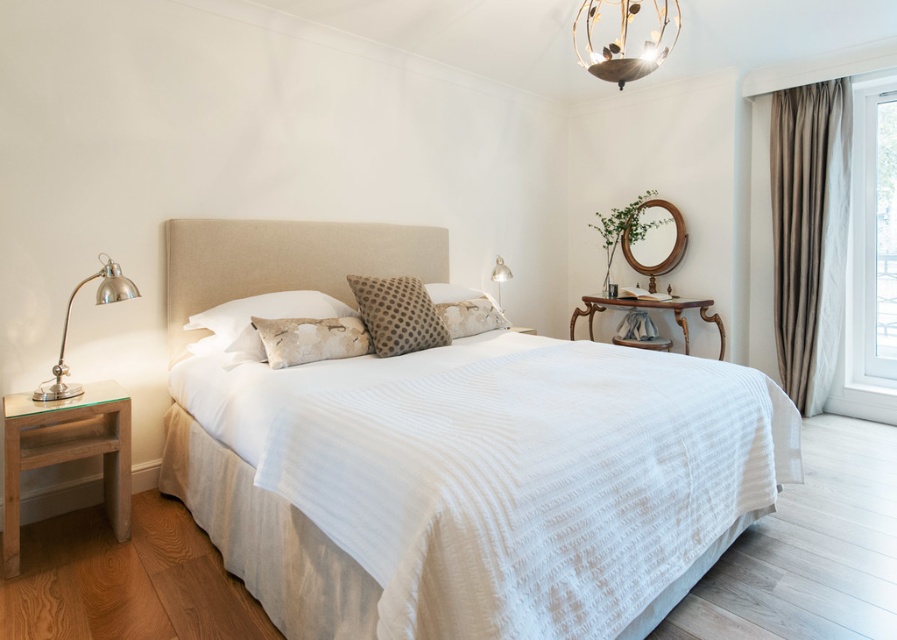
Can you confirm if brown velvet curtain at right is bigger than brown dotted pillow at center?

Correct, brown velvet curtain at right is larger in size than brown dotted pillow at center.

Who is lower down, brown velvet curtain at right or brown dotted pillow at center?

brown dotted pillow at center

Is point (811, 388) more distant than point (373, 320)?

Yes, it is.

Image resolution: width=897 pixels, height=640 pixels. Identify the location of brown velvet curtain at right. (808, 232).

Looking at this image, can you confirm if white textured pillow at center is thinner than fluffy beige pillow at center?

Incorrect, white textured pillow at center's width is not less than fluffy beige pillow at center's.

This screenshot has height=640, width=897. Describe the element at coordinates (258, 316) in the screenshot. I see `white textured pillow at center` at that location.

Is point (201, 349) behind point (454, 332)?

No, (201, 349) is closer to viewer.

Where is `white textured pillow at center`? white textured pillow at center is located at coordinates (258, 316).

Is point (295, 397) farther from viewer compared to point (489, 307)?

No.

Where is `white textured bed at center`? Image resolution: width=897 pixels, height=640 pixels. white textured bed at center is located at coordinates (472, 483).